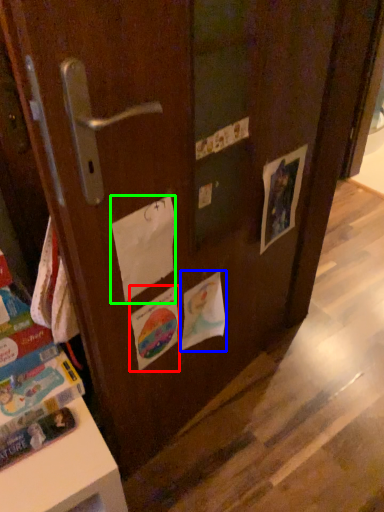
Question: Considering the real-world distances, which object is closest to flyer (highlighted by a red box)? flyer (highlighted by a blue box) or paper (highlighted by a green box).

Choices:
 (A) flyer
 (B) paper

Answer: (A)